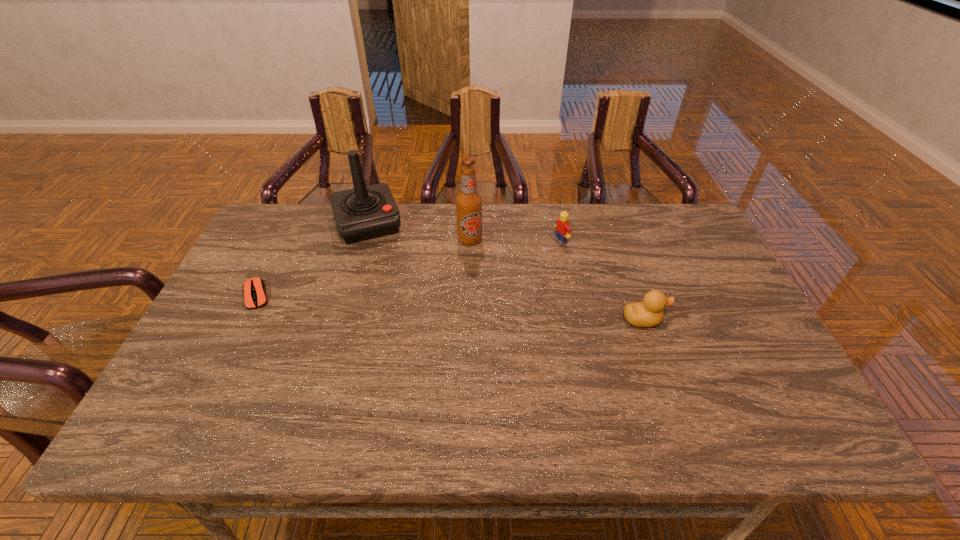
In order to click on computer mouse in this screenshot , I will do `click(254, 289)`.

Locate an element on the screen. The image size is (960, 540). the leftmost object is located at coordinates (254, 289).

Identify the location of duckling. The width and height of the screenshot is (960, 540). (649, 312).

Where is `the third object from right to left`? the third object from right to left is located at coordinates (469, 202).

The width and height of the screenshot is (960, 540). I want to click on Lego, so click(563, 230).

Locate an element on the screen. The height and width of the screenshot is (540, 960). the fourth object from right to left is located at coordinates (365, 212).

At what (x,y) coordinates should I click in order to perform the action: click on vacant space located on the back of the computer mouse. Please return your answer as a coordinate pair (x, y). This screenshot has height=540, width=960. Looking at the image, I should click on (291, 228).

The width and height of the screenshot is (960, 540). I want to click on free point located on the face of the duckling, so click(718, 320).

Find the location of `vacant space located 0.250m on the front label of the third object from right to left`. vacant space located 0.250m on the front label of the third object from right to left is located at coordinates (490, 307).

I want to click on blank space located on the front label of the third object from right to left, so click(x=495, y=326).